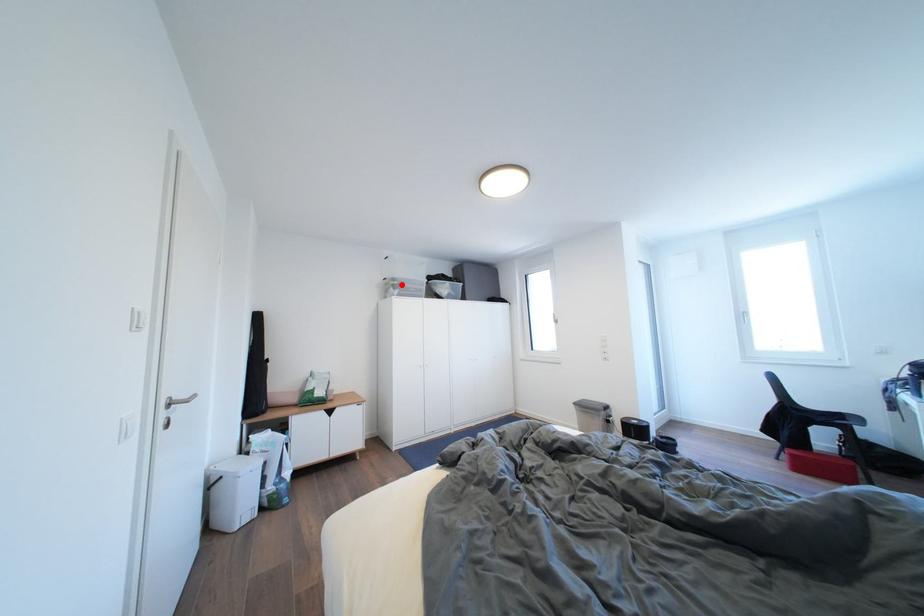
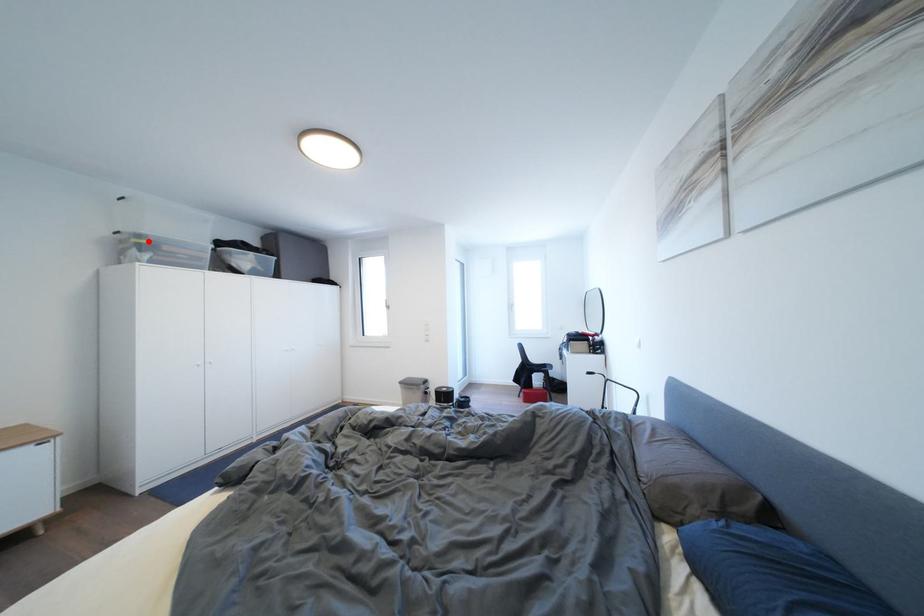
I am providing you with two images of the same scene from different viewpoints. A red point is marked on the first image and another point is marked on the second image. Do the highlighted points in image1 and image2 indicate the same real-world spot?

Yes